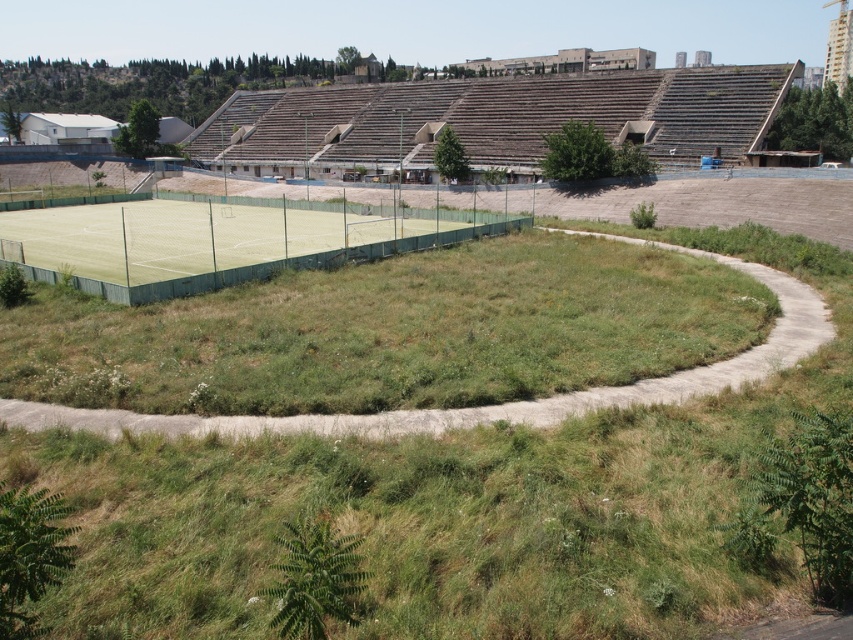
Question: Does green grassy circle at center appear on the right side of brown wooden amphitheater at upper center?

Choices:
 (A) no
 (B) yes

Answer: (B)

Question: Estimate the real-world distances between objects in this image. Which object is farther from the brown wooden amphitheater at upper center?

Choices:
 (A) green synthetic turf tennis court at center
 (B) green grassy circle at center

Answer: (B)

Question: Based on their relative distances, which object is farther from the brown wooden amphitheater at upper center?

Choices:
 (A) green grassy circle at center
 (B) green synthetic turf tennis court at center

Answer: (A)

Question: Considering the relative positions of green grassy circle at center and brown wooden amphitheater at upper center in the image provided, where is green grassy circle at center located with respect to brown wooden amphitheater at upper center?

Choices:
 (A) left
 (B) right

Answer: (B)

Question: Can you confirm if green grassy circle at center is smaller than green synthetic turf tennis court at center?

Choices:
 (A) no
 (B) yes

Answer: (B)

Question: Which point is farther to the camera?

Choices:
 (A) green synthetic turf tennis court at center
 (B) brown wooden amphitheater at upper center
 (C) green grassy circle at center

Answer: (B)